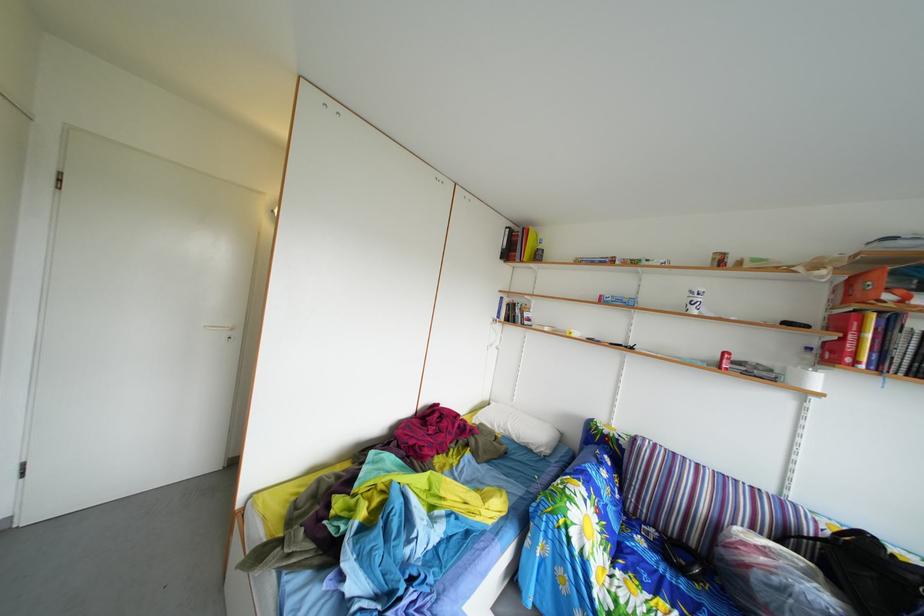
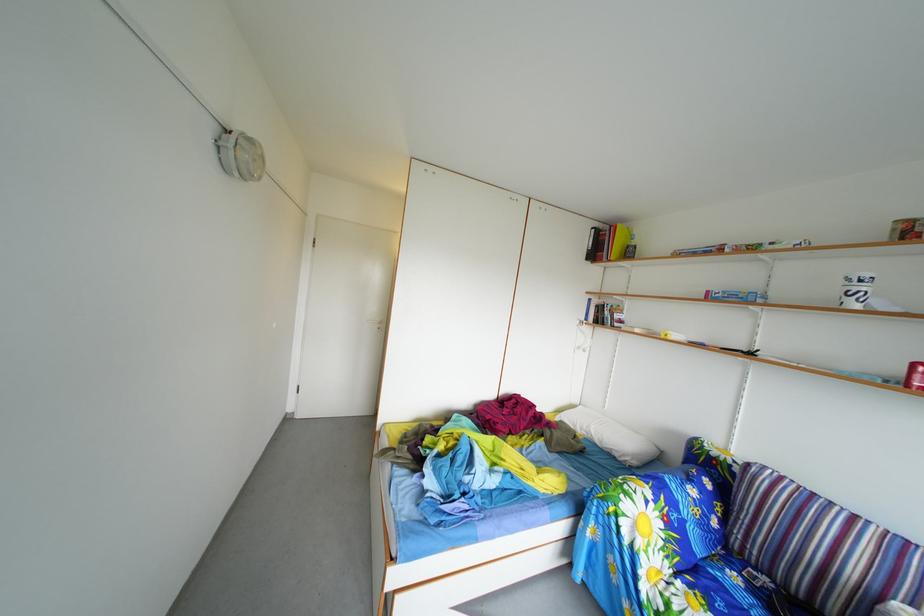
Find the pixel in the second image that matches (x=701, y=301) in the first image.

(859, 288)